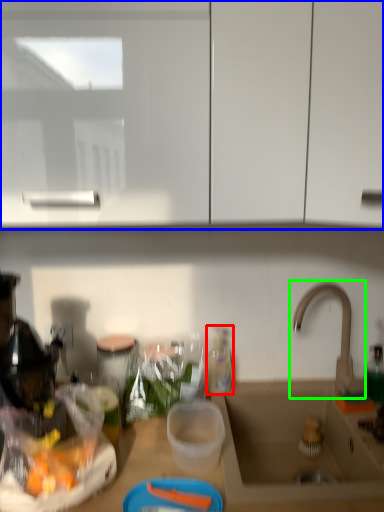
Question: Which object is the farthest from bottle (highlighted by a red box)? Choose among these: cabinetry (highlighted by a blue box) or tap (highlighted by a green box).

Choices:
 (A) cabinetry
 (B) tap

Answer: (A)